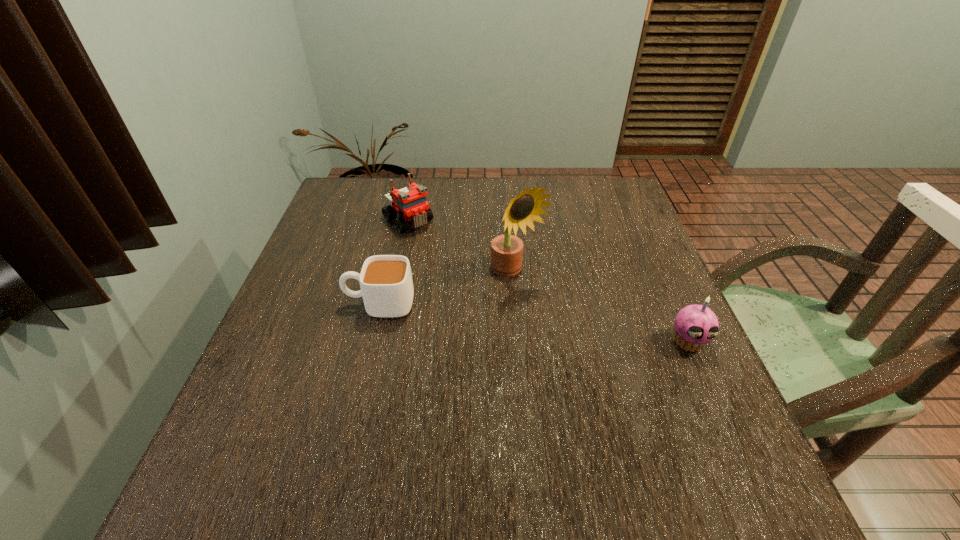
Where is `cup`? The height and width of the screenshot is (540, 960). cup is located at coordinates (386, 284).

At what (x,y) coordinates should I click in order to perform the action: click on cupcake. Please return your answer as a coordinate pair (x, y). Image resolution: width=960 pixels, height=540 pixels. Looking at the image, I should click on (695, 325).

I want to click on the nearest object, so click(695, 325).

Identify the location of Lego. (410, 203).

Image resolution: width=960 pixels, height=540 pixels. I want to click on sunflower, so click(506, 250).

This screenshot has height=540, width=960. I want to click on the tallest object, so click(x=506, y=250).

You are a GUI agent. You are given a task and a screenshot of the screen. Output one action in this format:
    pyautogui.click(x=<x>, y=<y>)
    Task: Click on the vacant space located 0.130m on the side with the handle of the cup
    
    Given the screenshot: What is the action you would take?
    pyautogui.click(x=288, y=304)

Locate an element on the screen. Image resolution: width=960 pixels, height=540 pixels. vacant area located 0.130m on the side with the handle of the cup is located at coordinates (288, 304).

I want to click on free space located on the side with the handle of the cup, so click(293, 304).

Locate an element on the screen. The width and height of the screenshot is (960, 540). free point located 0.140m on the face of the rightmost object is located at coordinates (723, 418).